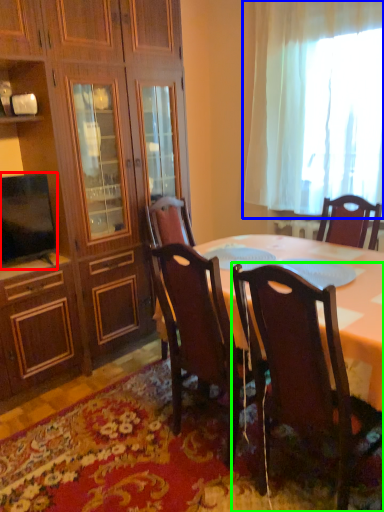
Question: Which is nearer to the television (highlighted by a red box)? curtain (highlighted by a blue box) or chair (highlighted by a green box).

Choices:
 (A) curtain
 (B) chair

Answer: (B)